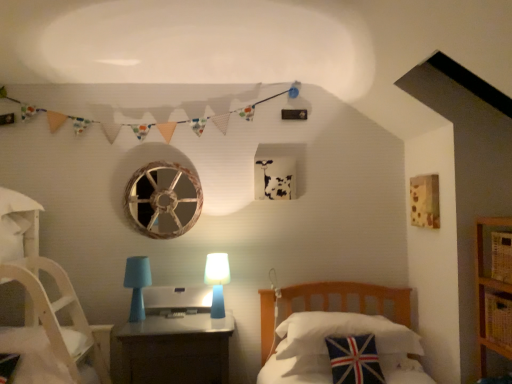
Question: From the image's perspective, is matte plastic nightstand at center located above or below union jack fabric pillow at center, which is the 2th pillow from front to back?

Choices:
 (A) below
 (B) above

Answer: (A)

Question: Is matte plastic nightstand at center taller or shorter than union jack fabric pillow at center, which is the 2th pillow from front to back?

Choices:
 (A) short
 (B) tall

Answer: (B)

Question: Estimate the real-world distances between objects in this image. Which object is closer to the satin silver desktop at center?

Choices:
 (A) yellow woven basket at lower right
 (B) light blue plastic table lamp at center, the first table lamp from the left
 (C) matte plastic nightstand at center
 (D) blue matte table lamp at center, positioned as the 1th table lamp in right-to-left order
 (E) union jack fabric pillow at lower right, which appears as the first pillow when viewed from the front

Answer: (B)

Question: Estimate the real-world distances between objects in this image. Which object is closer to the union jack fabric pillow at center, which is the 2th pillow from front to back?

Choices:
 (A) satin silver desktop at center
 (B) matte plastic nightstand at center
 (C) blue matte table lamp at center, which appears as the second table lamp when viewed from the left
 (D) light blue plastic table lamp at center, the 2th table lamp viewed from the right
 (E) union jack fabric pillow at lower right, which appears as the first pillow when viewed from the front

Answer: (E)